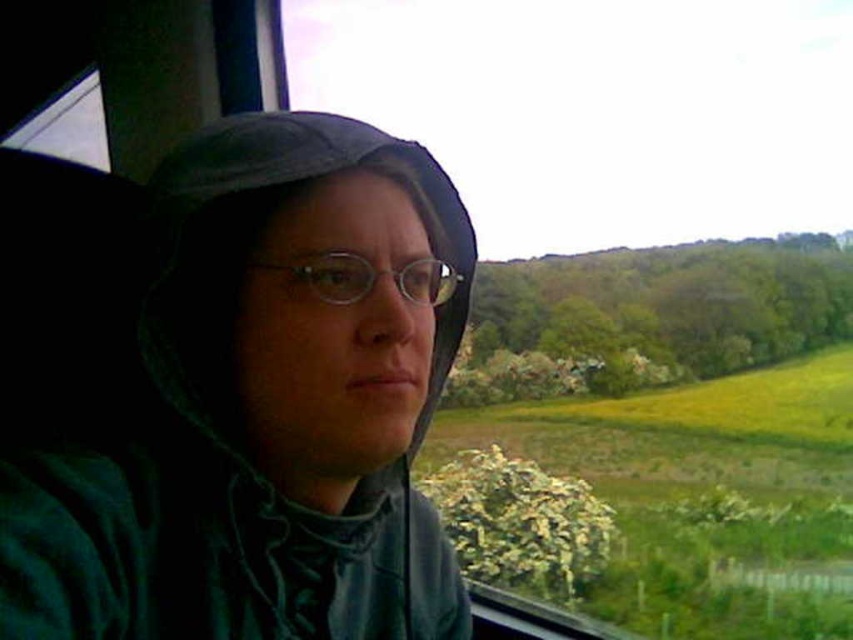
You are a fashion designer observing the person in the scene. You need to determine if the green matte jacket at left can be worn over the clear plastic glasses at center without adjusting their position. Based on their sizes, what do you think?

The green matte jacket at left is taller than the clear plastic glasses at center, so it can be worn over them without needing to adjust the glasses position.

You are a passenger on a train and notice two items in your compartment. One is the green matte jacket at left and the other is the clear plastic glasses at center. Which item is nearer to you?

The green matte jacket at left is closer to the viewer than the clear plastic glasses at center.